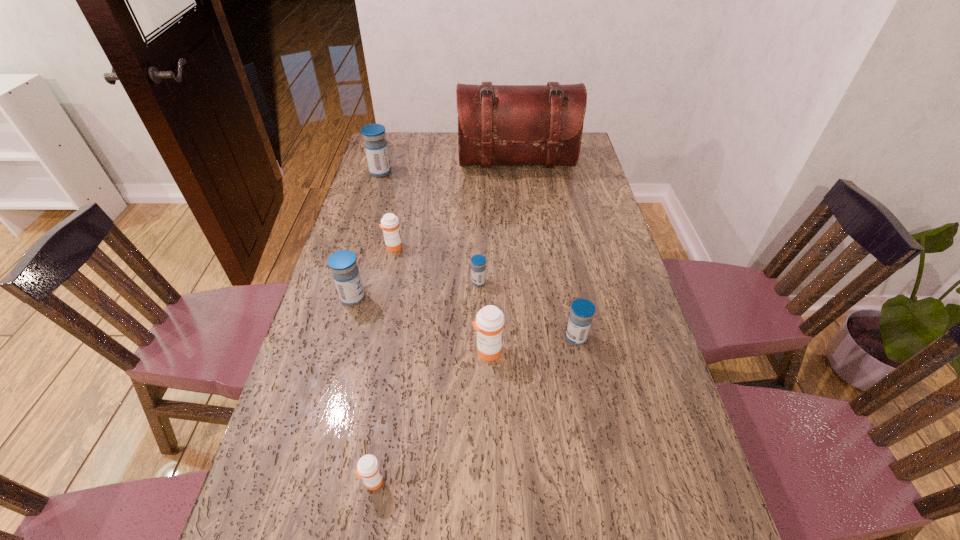
Find the location of `free space located on the back of the farthest orange medicine`. free space located on the back of the farthest orange medicine is located at coordinates (397, 226).

The height and width of the screenshot is (540, 960). In order to click on blank space located on the left of the second smallest blue medicine in this screenshot , I will do `click(417, 338)`.

At what (x,y) coordinates should I click in order to perform the action: click on free space located 0.110m on the back of the third nearest blue medicine. Please return your answer as a coordinate pair (x, y). The image size is (960, 540). Looking at the image, I should click on (479, 252).

Locate an element on the screen. The width and height of the screenshot is (960, 540). vacant space located on the back of the fourth medicine from right to left is located at coordinates (398, 330).

Locate an element on the screen. The width and height of the screenshot is (960, 540). object that is positioned at the far edge is located at coordinates (497, 124).

Where is `object located in the right edge section of the desktop`? The width and height of the screenshot is (960, 540). object located in the right edge section of the desktop is located at coordinates (497, 124).

Identify the location of object at the far right corner. (497, 124).

The width and height of the screenshot is (960, 540). Find the location of `vacant position at the left edge of the desktop`. vacant position at the left edge of the desktop is located at coordinates (355, 220).

Locate an element on the screen. vacant space at the right edge of the desktop is located at coordinates (637, 355).

Locate an element on the screen. Image resolution: width=960 pixels, height=540 pixels. free space at the far left corner of the desktop is located at coordinates (391, 156).